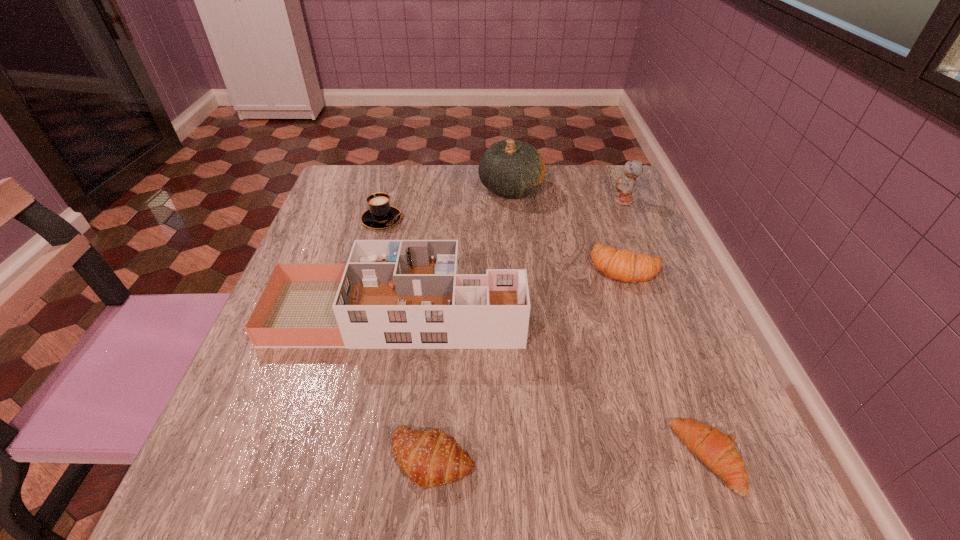
What are the coordinates of `gourd` in the screenshot? It's located at (509, 168).

Find the location of a particular element. teddy bear is located at coordinates (625, 186).

This screenshot has height=540, width=960. In order to click on dollhouse in this screenshot , I will do `click(394, 294)`.

Find the location of a particular element. The height and width of the screenshot is (540, 960). the farthest crescent roll is located at coordinates (623, 265).

This screenshot has width=960, height=540. What are the coordinates of `cappuccino` in the screenshot? It's located at (380, 214).

Locate an element on the screen. This screenshot has width=960, height=540. the sixth tallest object is located at coordinates (431, 458).

Where is `the second tallest crescent roll`? The image size is (960, 540). the second tallest crescent roll is located at coordinates (431, 458).

You are a GUI agent. You are given a task and a screenshot of the screen. Output one action in this format:
    pyautogui.click(x=<x>, y=<y>)
    Task: Click on the shortest object
    
    Given the screenshot: What is the action you would take?
    pyautogui.click(x=717, y=450)

Where is `vacant area situated 0.280m on the left of the tallest object`? This screenshot has height=540, width=960. vacant area situated 0.280m on the left of the tallest object is located at coordinates (372, 188).

This screenshot has height=540, width=960. I want to click on vacant space located 0.310m on the front-facing side of the teddy bear, so click(x=492, y=201).